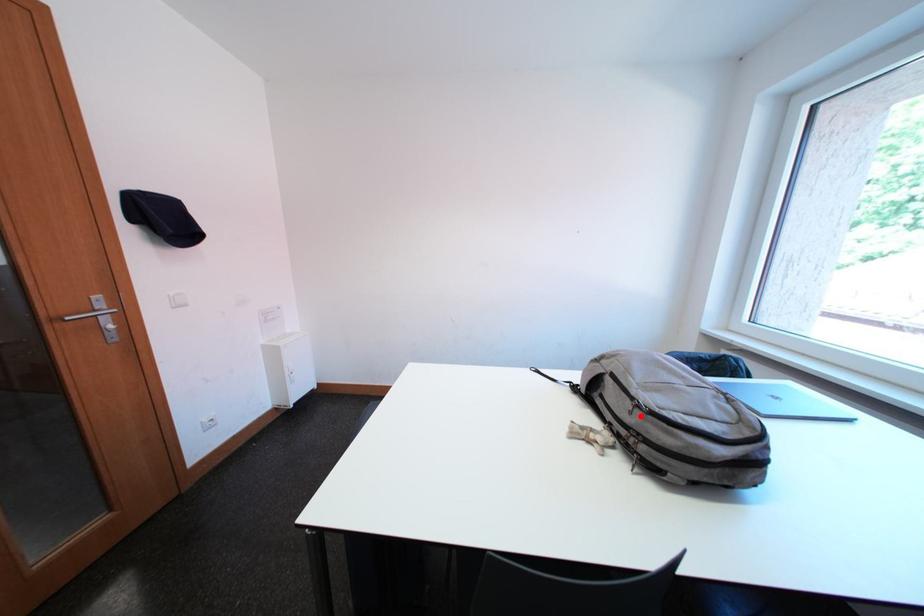
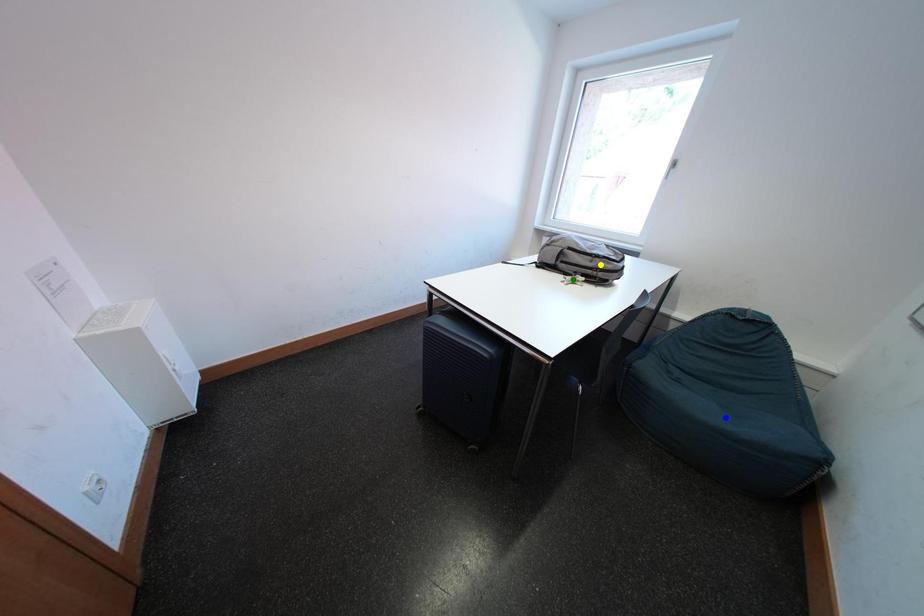
Question: I am providing you with two images of the same scene from different viewpoints. A red point is marked on the first image. You are given multiple points on the second image. In image 2, which mark is for the same physical point as the one in image 1?

Choices:
 (A) green point
 (B) blue point
 (C) yellow point

Answer: (C)